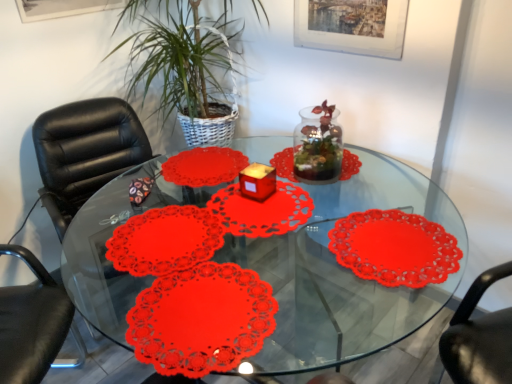
Question: Can transparent plastic placemats at center be found inside green leafy plant at center?

Choices:
 (A) yes
 (B) no

Answer: (B)

Question: Is green leafy plant at center to the right of transparent plastic placemats at center from the viewer's perspective?

Choices:
 (A) yes
 (B) no

Answer: (B)

Question: From the image's perspective, is green leafy plant at center located beneath transparent plastic placemats at center?

Choices:
 (A) no
 (B) yes

Answer: (A)

Question: Is green leafy plant at center positioned beyond the bounds of transparent plastic placemats at center?

Choices:
 (A) no
 (B) yes

Answer: (B)

Question: Can you confirm if green leafy plant at center is taller than transparent plastic placemats at center?

Choices:
 (A) yes
 (B) no

Answer: (A)

Question: From the image's perspective, is metallic silver picture frame at upper center above or below transparent plastic placemats at center?

Choices:
 (A) above
 (B) below

Answer: (A)

Question: Relative to transparent plastic placemats at center, is metallic silver picture frame at upper center in front or behind?

Choices:
 (A) behind
 (B) front

Answer: (A)

Question: Looking at the image, does metallic silver picture frame at upper center seem bigger or smaller compared to transparent plastic placemats at center?

Choices:
 (A) big
 (B) small

Answer: (B)

Question: Considering the positions of metallic silver picture frame at upper center and transparent plastic placemats at center in the image, is metallic silver picture frame at upper center taller or shorter than transparent plastic placemats at center?

Choices:
 (A) short
 (B) tall

Answer: (A)

Question: Considering the positions of green leafy plant at center and transparent plastic placemats at center in the image, is green leafy plant at center bigger or smaller than transparent plastic placemats at center?

Choices:
 (A) big
 (B) small

Answer: (B)

Question: Considering the positions of green leafy plant at center and transparent plastic placemats at center in the image, is green leafy plant at center taller or shorter than transparent plastic placemats at center?

Choices:
 (A) tall
 (B) short

Answer: (A)

Question: Is point click(176, 89) positioned closer to the camera than point click(263, 150)?

Choices:
 (A) farther
 (B) closer

Answer: (B)

Question: From a real-world perspective, is green leafy plant at center physically located above or below transparent plastic placemats at center?

Choices:
 (A) below
 (B) above

Answer: (B)

Question: Considering the positions of matte paper doily at center and black leather chair at left in the image, is matte paper doily at center bigger or smaller than black leather chair at left?

Choices:
 (A) big
 (B) small

Answer: (B)

Question: From the image's perspective, is matte paper doily at center positioned above or below black leather chair at left?

Choices:
 (A) above
 (B) below

Answer: (B)